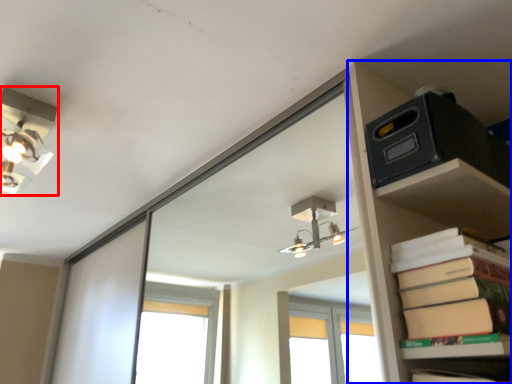
Question: Which point is closer to the camera, lamp (highlighted by a red box) or shelf (highlighted by a blue box)?

Choices:
 (A) lamp
 (B) shelf

Answer: (B)